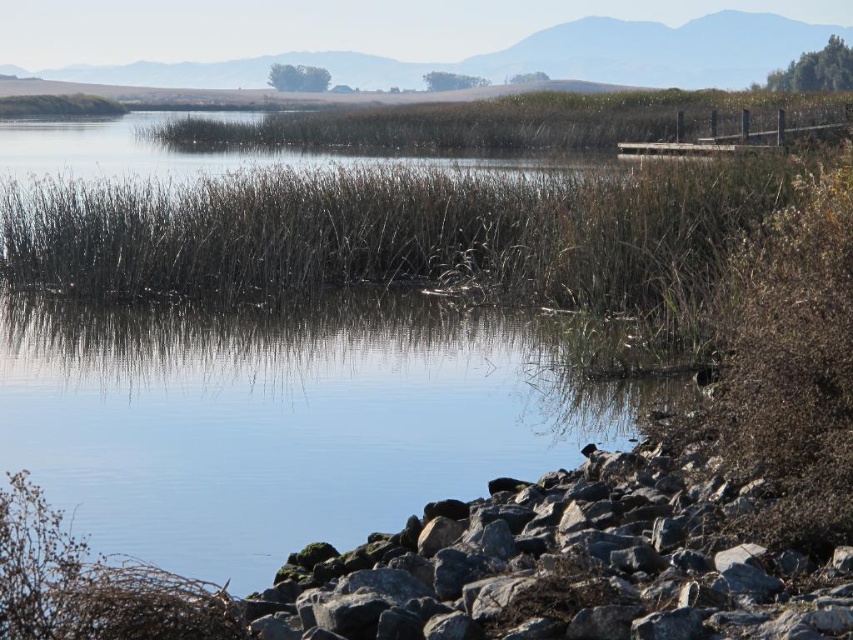
You are a small animal trying to cross from the gray rock at lower right to the brown dry grass at lower left. Based on the scene, which direction should you move to reach your destination?

The gray rock at lower right is located below the brown dry grass at lower left, so you should move upward to reach the brown dry grass at lower left from the gray rock at lower right.

You are a photographer standing at the edge of the lake, aiming to capture a photo that includes both the point at coordinates point (403, 490) and point (16, 602). Which point should you focus on first to ensure both are in sharp focus?

You should focus on point (16, 602) first because it is closer to you than point (403, 490), which is further away. By focusing on the closer point, the further point may still be within the depth of field for sharpness.